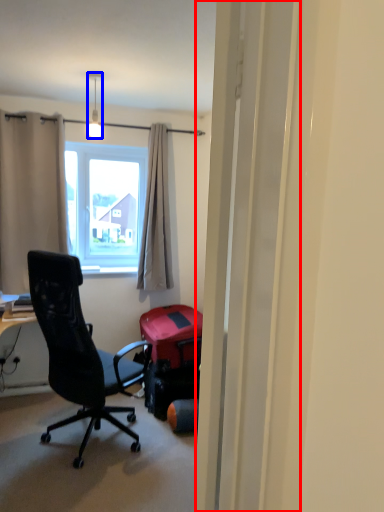
Question: Which object appears farthest to the camera in this image, screen door (highlighted by a red box) or lamp (highlighted by a blue box)?

Choices:
 (A) screen door
 (B) lamp

Answer: (B)